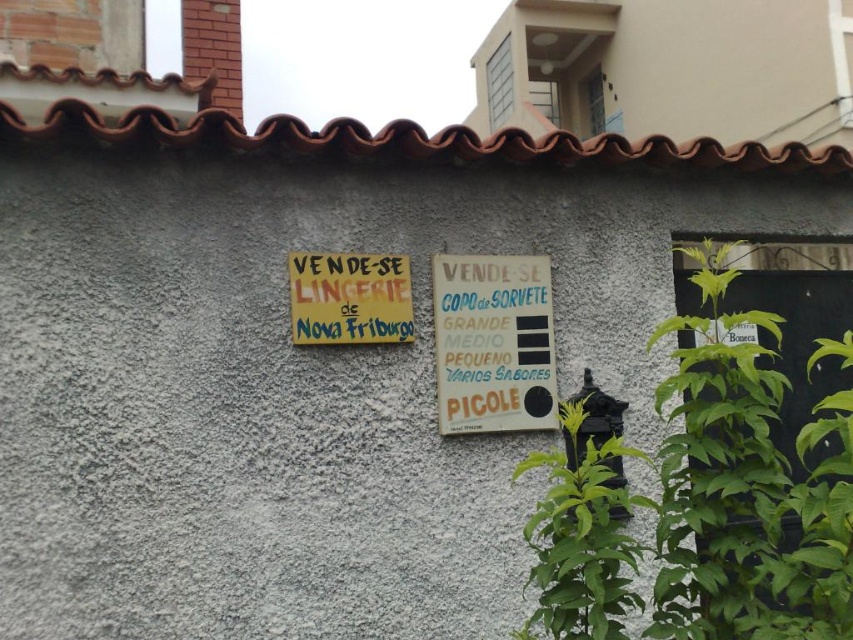
What is the spatial relationship between the white paper sign at center and the yellow paper sign at upper center?

The white paper sign at center is closer to the viewer than the yellow paper sign at upper center.

You are a delivery person who needs to hang a new sign that is 8 inches wide between the white paper sign at center and the yellow paper sign at upper center. Can you fit it there without overlapping either sign?

The white paper sign at center is 7.86 inches from the yellow paper sign at upper center. Since the new sign is 8 inches wide, it would overlap both signs when placed between them.